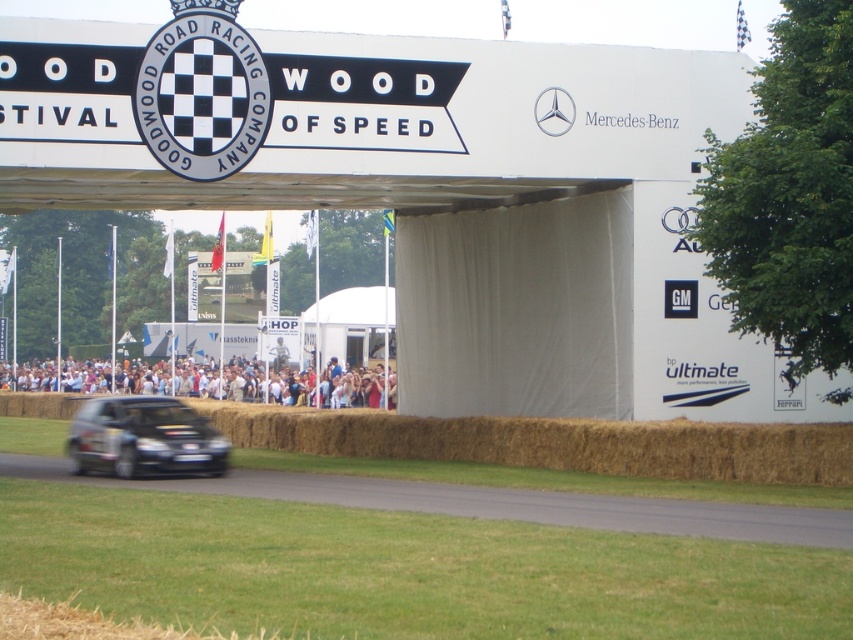
Question: Which point appears closest to the camera in this image?

Choices:
 (A) 109,440
 (B) 471,512

Answer: (B)

Question: Considering the real-world distances, which object is farthest from the black asphalt road at lower center?

Choices:
 (A) black glossy hatchback at lower left
 (B) light brown hair at lower center

Answer: (B)

Question: Which point is closer to the camera?

Choices:
 (A) (189, 380)
 (B) (538, 522)
 (C) (164, 440)

Answer: (B)

Question: Does black asphalt road at lower center have a lesser width compared to light brown hair at lower center?

Choices:
 (A) no
 (B) yes

Answer: (B)

Question: Does black glossy hatchback at lower left appear over light brown hair at lower center?

Choices:
 (A) yes
 (B) no

Answer: (B)

Question: Is black glossy hatchback at lower left closer to camera compared to light brown hair at lower center?

Choices:
 (A) no
 (B) yes

Answer: (B)